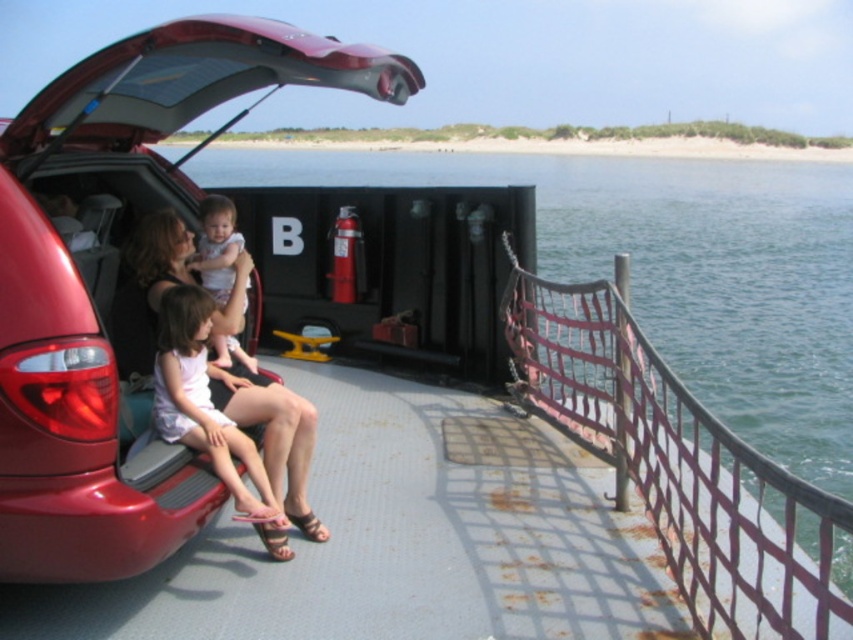
Question: Which point appears closest to the camera in this image?

Choices:
 (A) (299, 410)
 (B) (769, 195)

Answer: (A)

Question: Which of these objects is positioned farthest from the rusty metal rail at right?

Choices:
 (A) clear water at center
 (B) light pink fabric baby at center
 (C) shiny red car at center

Answer: (A)

Question: Which is farther from the shiny red car at center?

Choices:
 (A) light pink fabric baby at center
 (B) matte black shorts at lower left
 (C) rusty metal rail at right
 (D) clear water at center

Answer: (D)

Question: Is clear water at center positioned at the back of rusty metal rail at right?

Choices:
 (A) no
 (B) yes

Answer: (B)

Question: Does shiny red car at center appear under matte black shorts at lower left?

Choices:
 (A) yes
 (B) no

Answer: (B)

Question: Can you confirm if shiny red car at center is positioned above matte black shorts at lower left?

Choices:
 (A) no
 (B) yes

Answer: (B)